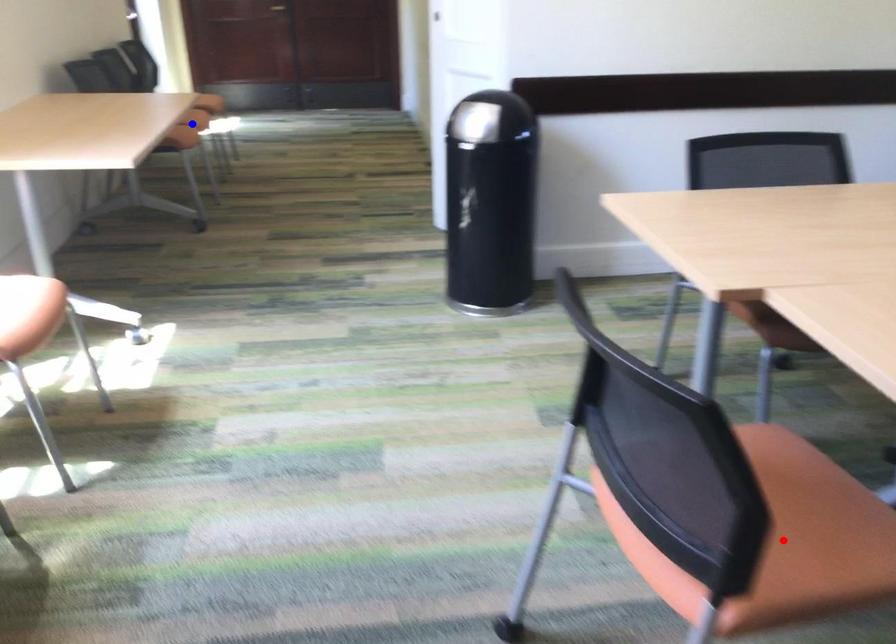
Question: Two points are marked on the image. Which point is closer to the camera?

Choices:
 (A) Blue point is closer.
 (B) Red point is closer.

Answer: (B)